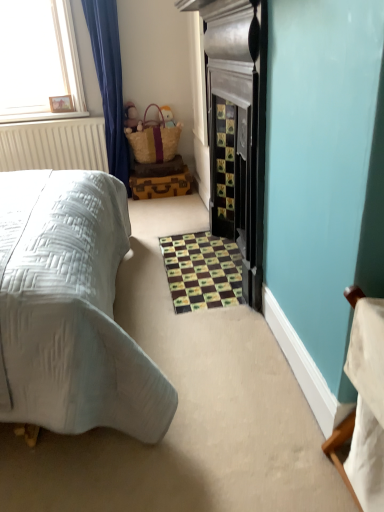
Question: From a real-world perspective, is brown mosaic tiles at center above or below matte brown wicker basket at upper center, acting as the first toy starting from the right?

Choices:
 (A) below
 (B) above

Answer: (A)

Question: From the image's perspective, is brown mosaic tiles at center located above or below matte brown wicker basket at upper center, arranged as the 2th toy when viewed from the left?

Choices:
 (A) above
 (B) below

Answer: (B)

Question: Which object is positioned closest to the matte brown wicker basket at upper center, acting as the first toy starting from the right?

Choices:
 (A) woven straw basket at upper center
 (B) matte brown plush toy at upper left, the second toy positioned from the right
 (C) brown mosaic tiles at center

Answer: (A)

Question: Estimate the real-world distances between objects in this image. Which object is closer to the matte brown wicker basket at upper center, arranged as the 2th toy when viewed from the left?

Choices:
 (A) woven straw basket at upper center
 (B) matte brown plush toy at upper left, the second toy positioned from the right
 (C) brown mosaic tiles at center

Answer: (A)